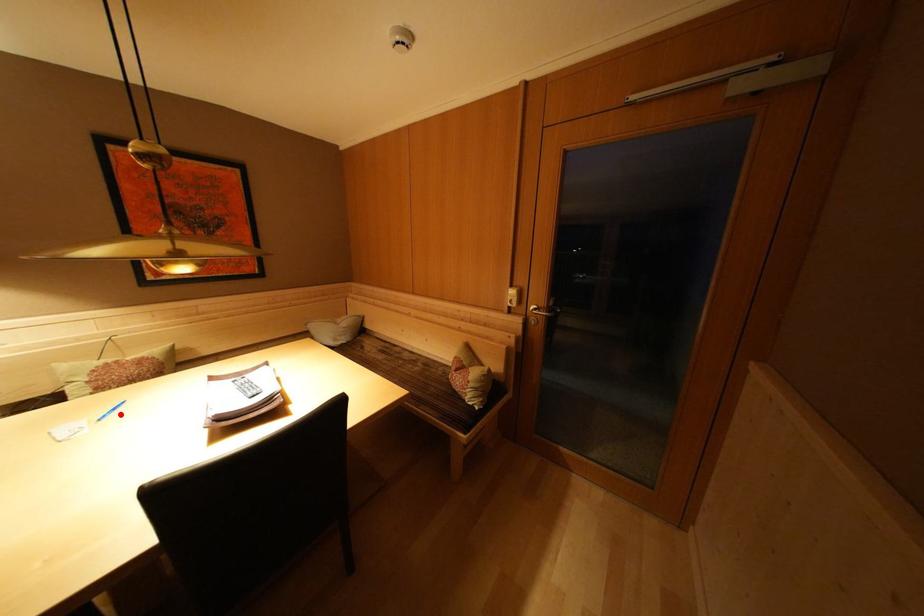
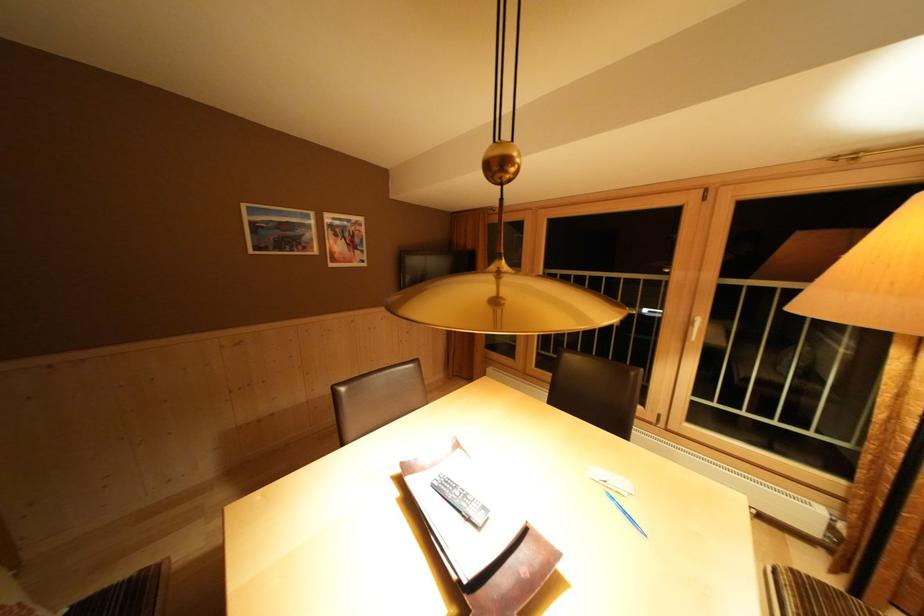
The point at the highlighted location is marked in the first image. Where is the corresponding point in the second image?

(633, 517)